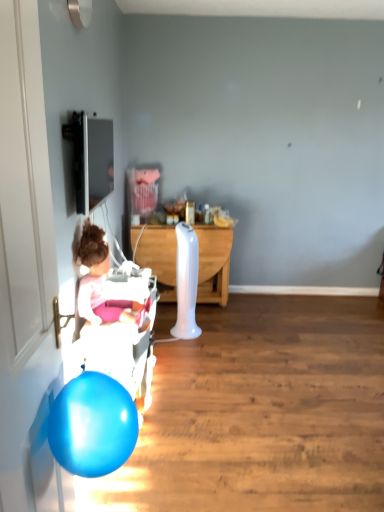
Where is `vacant area that is situated to the right of white plastic baby carriage at left`? vacant area that is situated to the right of white plastic baby carriage at left is located at coordinates (227, 411).